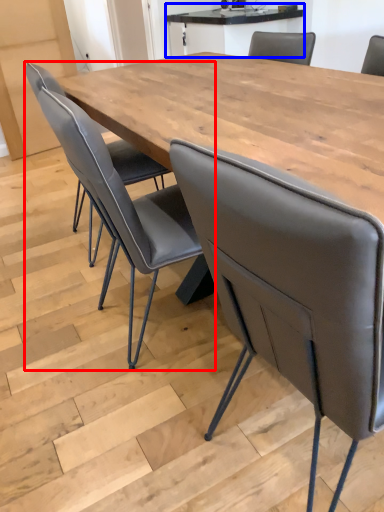
Question: Which object is closer to the camera taking this photo, chair (highlighted by a red box) or table (highlighted by a blue box)?

Choices:
 (A) chair
 (B) table

Answer: (A)